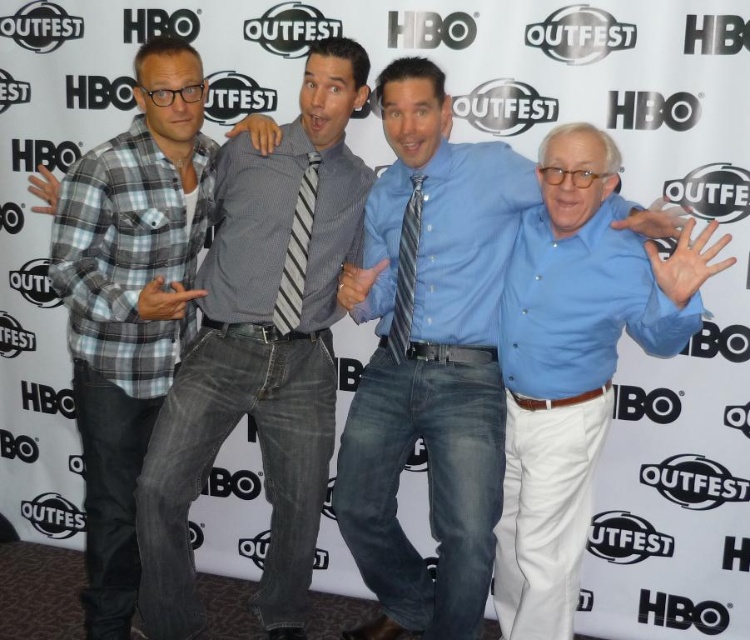
You are standing at the center of the image and want to reach both the point at position (396, 72) and the point at position (573, 384). Which point will you reach first?

Since point (396, 72) is closer to you than point (573, 384), you will reach point (396, 72) first.